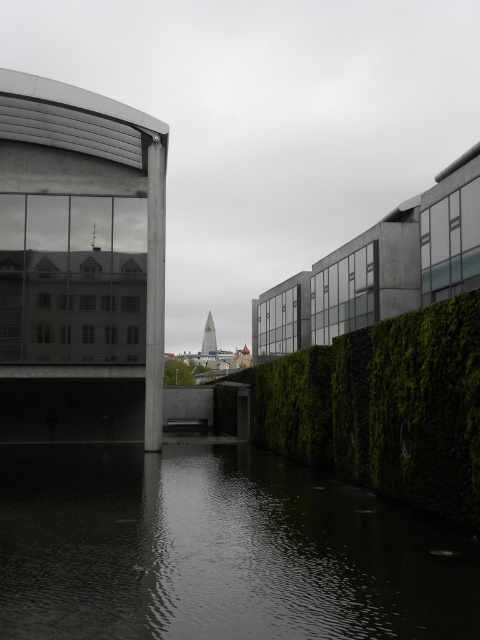
Based on the photo, you are standing in the urban scene and want to walk from the dark reflective water at bottom to the green mossy hedge at center. Which direction should you move?

You should move to the right to reach the green mossy hedge at center from the dark reflective water at bottom because the water is located to the left of the hedge.

You are a drone operator trying to navigate between the dark reflective water at bottom and the green mossy hedge at center. Based on the scene, which object is positioned higher from the ground?

The dark reflective water at bottom is located above the green mossy hedge at center, so it is positioned higher from the ground.

You are standing in the urban scene and want to cross the dark reflective water at bottom to reach the other side. If your walking speed is 1.2 meters per second, how many seconds will it take to cross the water?

The dark reflective water at bottom is 5.44 meters from camera. At a walking speed of 1.2 meters per second, it would take approximately 4.53 seconds to cross the water.